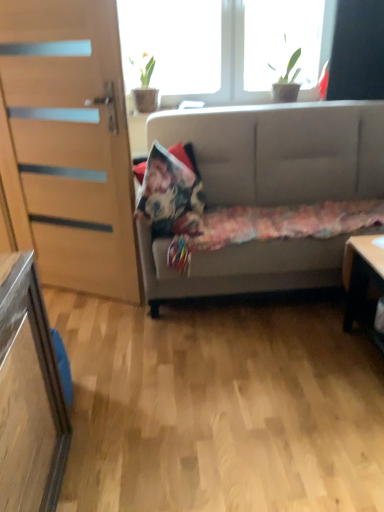
You are a GUI agent. You are given a task and a screenshot of the screen. Output one action in this format:
    pyautogui.click(x=<x>, y=<y>)
    Task: Click on the vacant space underneath wooden door at left (from a real-world perspective)
    The width and height of the screenshot is (384, 512).
    Given the screenshot: What is the action you would take?
    pyautogui.click(x=89, y=297)